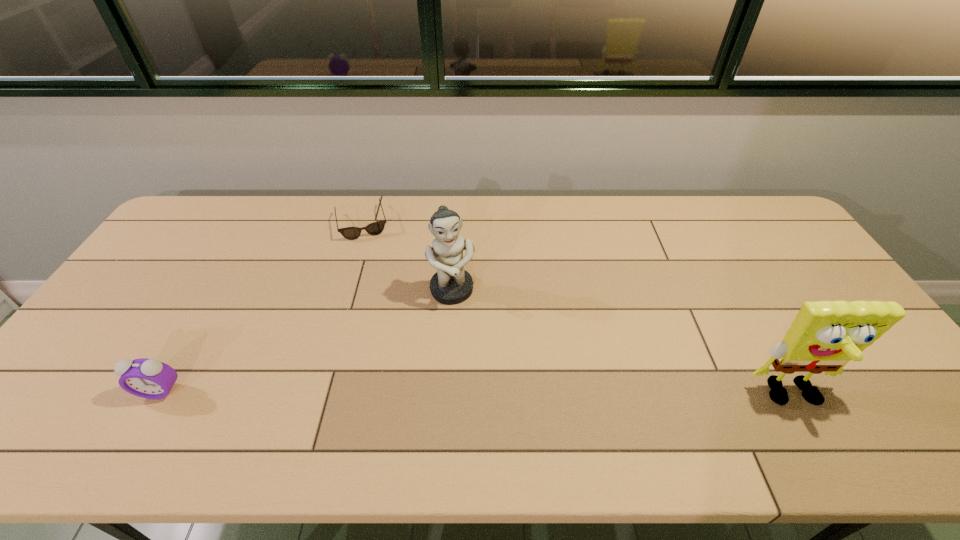
The width and height of the screenshot is (960, 540). Identify the location of free space between the rightmost object and the shortest object. (578, 310).

Find the location of `vacant region between the alarm clock and the third object from left to right`. vacant region between the alarm clock and the third object from left to right is located at coordinates (306, 341).

Where is `vacant area between the rightmost object and the third nearest object`? This screenshot has height=540, width=960. vacant area between the rightmost object and the third nearest object is located at coordinates (622, 344).

Locate an element on the screen. empty space between the shortest object and the alarm clock is located at coordinates (261, 307).

The width and height of the screenshot is (960, 540). I want to click on vacant point located between the second object from left to right and the figurine, so [407, 257].

Identify the location of vacant space that is in between the rightmost object and the alarm clock. The width and height of the screenshot is (960, 540). (476, 394).

Find the location of a particular element. The image size is (960, 540). vacant space that's between the second farthest object and the leftmost object is located at coordinates (306, 341).

Locate an element on the screen. vacant point located between the figurine and the alarm clock is located at coordinates (306, 341).

Identify the location of vacant point located between the alarm clock and the sponge. (476, 394).

At what (x,y) coordinates should I click in order to perform the action: click on object that can be found as the third closest to the sponge. Please return your answer as a coordinate pair (x, y). Looking at the image, I should click on (147, 378).